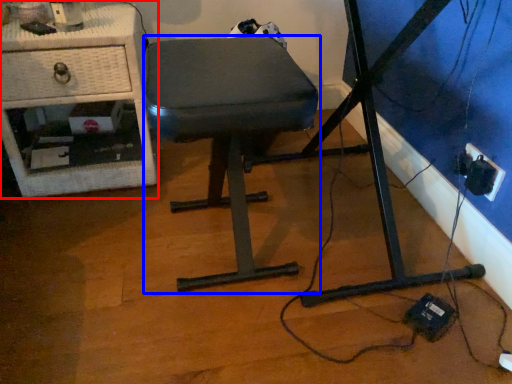
Question: Which point is further to the camera, furniture (highlighted by a red box) or stool (highlighted by a blue box)?

Choices:
 (A) furniture
 (B) stool

Answer: (A)